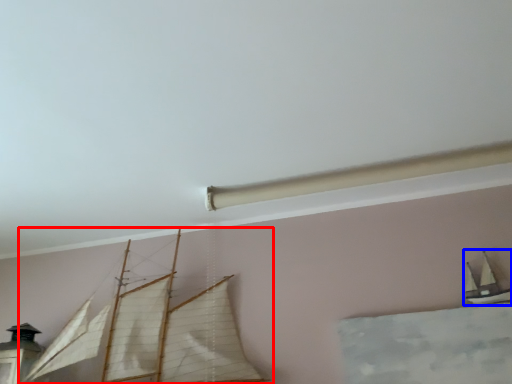
Question: Which of the following is the farthest to the observer, boat (highlighted by a red box) or boat (highlighted by a blue box)?

Choices:
 (A) boat
 (B) boat

Answer: (B)